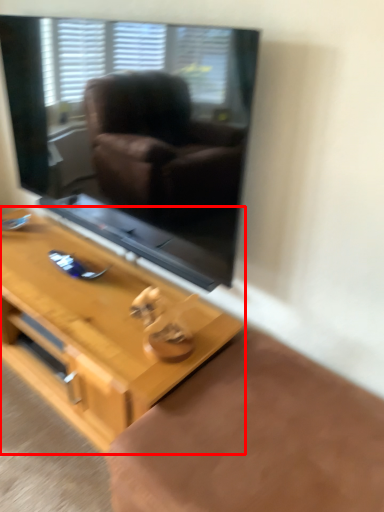
Question: In this image, where is table (annotated by the red box) located relative to window screen?

Choices:
 (A) left
 (B) right

Answer: (A)